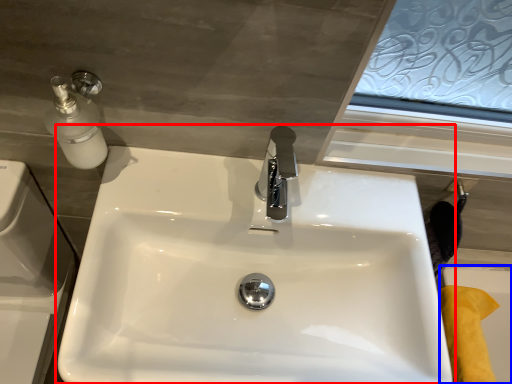
Question: Which object appears closest to the camera in this image, sink (highlighted by a red box) or bath (highlighted by a blue box)?

Choices:
 (A) sink
 (B) bath

Answer: (A)